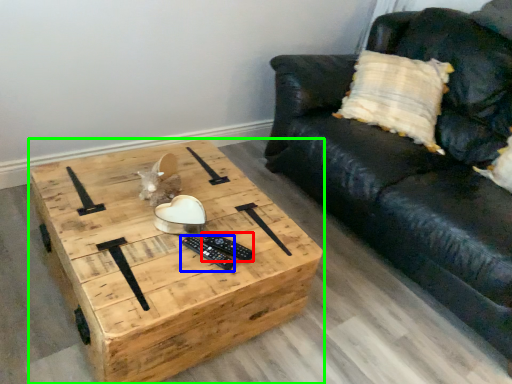
Question: Based on their relative distances, which object is farther from remote (highlighted by a red box)? Choose from remote (highlighted by a blue box) and coffee table (highlighted by a green box).

Choices:
 (A) remote
 (B) coffee table

Answer: (B)